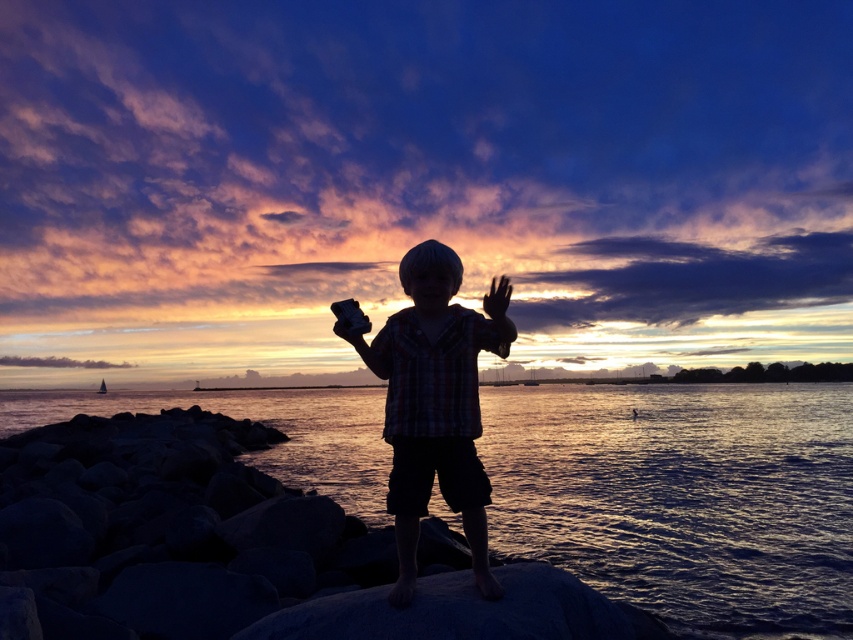
Question: Among these objects, which one is nearest to the camera?

Choices:
 (A) plaid shirt at center
 (B) silky skin hand at center
 (C) glistening water at center

Answer: (B)

Question: Based on their relative distances, which object is farther from the black matte hand at center?

Choices:
 (A) plaid shirt at center
 (B) glistening water at center

Answer: (B)

Question: Can you confirm if glistening water at center is positioned above silky skin hand at center?

Choices:
 (A) no
 (B) yes

Answer: (A)

Question: Is plaid shirt at center to the right of silky skin hand at center from the viewer's perspective?

Choices:
 (A) no
 (B) yes

Answer: (A)

Question: Which of the following is the closest to the observer?

Choices:
 (A) silky skin hand at center
 (B) plaid shirt at center
 (C) glistening water at center
 (D) black matte hand at center

Answer: (A)

Question: Where is glistening water at center located in relation to plaid shirt at center in the image?

Choices:
 (A) below
 (B) above

Answer: (A)